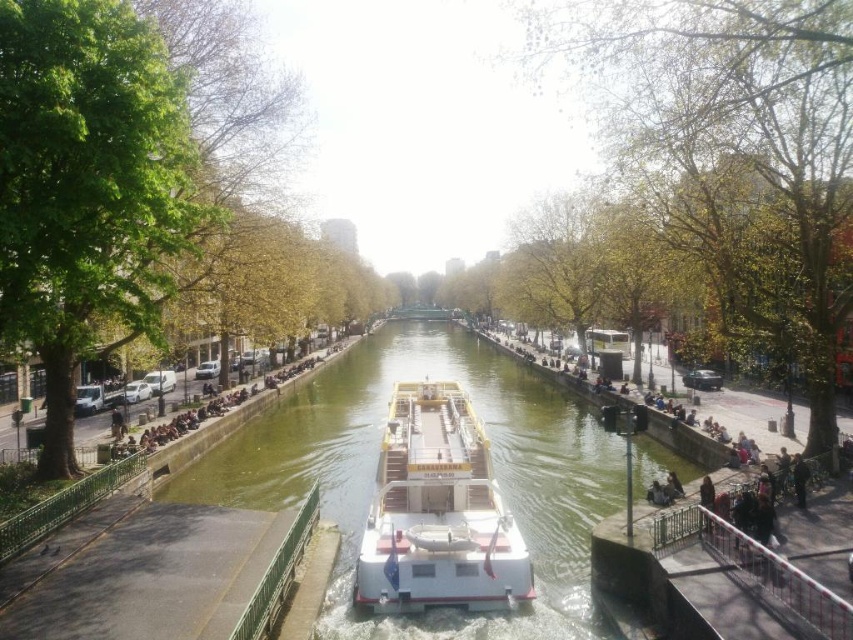
Question: Which object is positioned closest to the green leafy tree at left?

Choices:
 (A) green leafy tree at center
 (B) green smooth water at center
 (C) white matte boat at center

Answer: (C)

Question: Is green leafy tree at center thinner than green smooth water at center?

Choices:
 (A) no
 (B) yes

Answer: (B)

Question: Can you confirm if green smooth water at center is positioned below white matte boat at center?

Choices:
 (A) yes
 (B) no

Answer: (B)

Question: Based on their relative distances, which object is nearer to the green leafy tree at left?

Choices:
 (A) green leafy tree at center
 (B) white matte boat at center
 (C) green smooth water at center

Answer: (B)

Question: Which of the following is the farthest from the observer?

Choices:
 (A) (828, 99)
 (B) (112, 104)
 (C) (474, 337)

Answer: (C)

Question: Observing the image, what is the correct spatial positioning of green leafy tree at left in reference to white matte boat at center?

Choices:
 (A) right
 (B) left

Answer: (B)